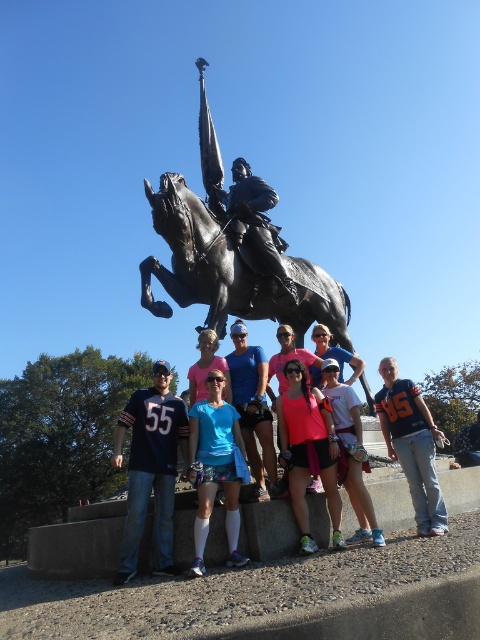
You are a photographer trying to capture a closeup of the blue jersey at center. Based on the coordinates provided in the Objects Description, which direction should you move your camera to focus on the jersey?

The blue jersey at center is located at point coordinates, so move your camera towards the center of the image to focus on it.

You are a photographer trying to capture the group photo of the nine individuals in front of the statue. You notice a point at coordinate point [216,468]. What object is located at that point?

The point at coordinate point [216,468] corresponds to the blue fabric shorts at center.

You are a photographer trying to capture a clear shot of the blue fabric shorts at center and the matte black jersey at center. Since you want to focus on both, which object should you adjust your camera focus on first to ensure both are in frame?

The blue fabric shorts at center is not as tall as matte black jersey at center, so you should focus on the matte black jersey at center first to ensure both are in frame.